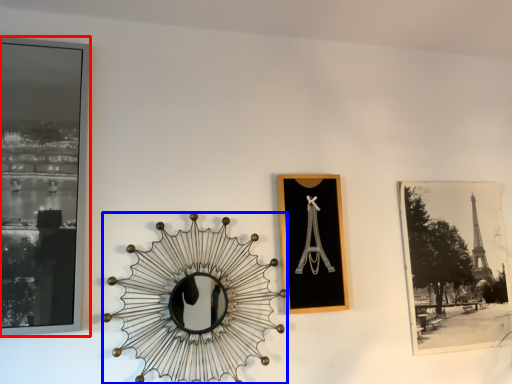
Question: Which object appears closest to the camera in this image, picture frame (highlighted by a red box) or design (highlighted by a blue box)?

Choices:
 (A) picture frame
 (B) design

Answer: (A)